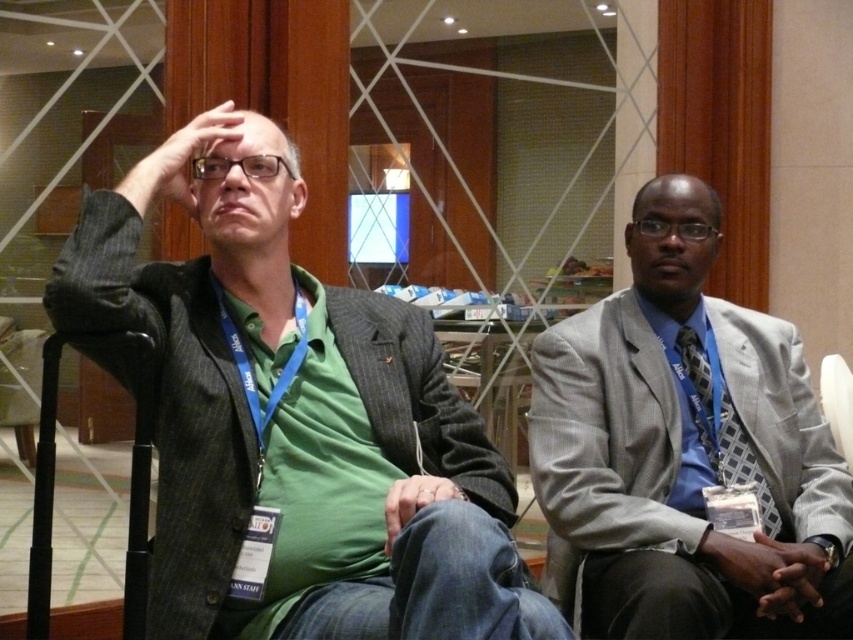
You are a photographer at the event and need to position two subjects for a group photo. The subjects are wearing the green fabric shirt at left and the gray textured suit at right. Which subject should you ask to stand in a position where their height won

The green fabric shirt at left is not as tall as the gray textured suit at right, so you should ask the person wearing the green fabric shirt at left to stand in a position where their height won